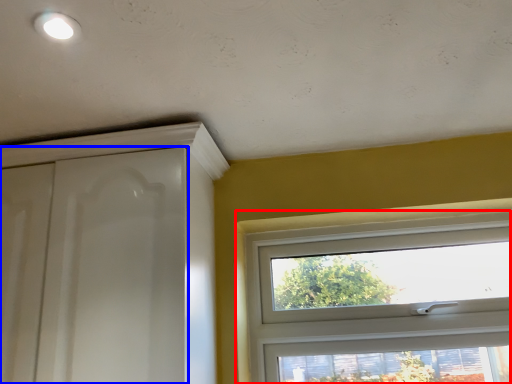
Question: Which object is further to the camera taking this photo, window (highlighted by a red box) or screen door (highlighted by a blue box)?

Choices:
 (A) window
 (B) screen door

Answer: (A)